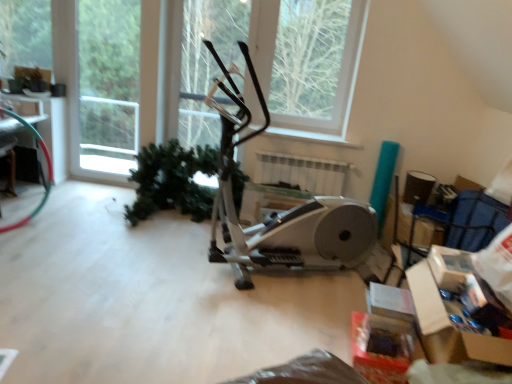
Question: Considering the relative sizes of silver metallic stationary bicycle at center and green matte tree at upper left, positioned as the second tree in right-to-left order, in the image provided, is silver metallic stationary bicycle at center thinner than green matte tree at upper left, positioned as the second tree in right-to-left order,?

Choices:
 (A) no
 (B) yes

Answer: (A)

Question: Is silver metallic stationary bicycle at center placed right next to green matte tree at upper left, positioned as the second tree in right-to-left order?

Choices:
 (A) no
 (B) yes

Answer: (A)

Question: Is silver metallic stationary bicycle at center completely or partially outside of green matte tree at upper left, positioned as the second tree in right-to-left order?

Choices:
 (A) no
 (B) yes

Answer: (B)

Question: From the image's perspective, would you say silver metallic stationary bicycle at center is shown under green matte tree at upper left, placed as the 1th tree when sorted from left to right?

Choices:
 (A) no
 (B) yes

Answer: (B)

Question: Does silver metallic stationary bicycle at center appear on the left side of green matte tree at upper left, placed as the 1th tree when sorted from left to right?

Choices:
 (A) yes
 (B) no

Answer: (B)

Question: Considering the relative positions of silver metallic stationary bicycle at center and green matte tree at upper center, which is the first tree in right-to-left order, in the image provided, is silver metallic stationary bicycle at center to the left or to the right of green matte tree at upper center, which is the first tree in right-to-left order,?

Choices:
 (A) right
 (B) left

Answer: (B)

Question: Considering the positions of point (312, 208) and point (301, 39), is point (312, 208) closer or farther from the camera than point (301, 39)?

Choices:
 (A) closer
 (B) farther

Answer: (A)

Question: Relative to green matte tree at upper center, the 2th tree when ordered from left to right, is silver metallic stationary bicycle at center in front or behind?

Choices:
 (A) behind
 (B) front

Answer: (B)

Question: Based on their sizes in the image, would you say silver metallic stationary bicycle at center is bigger or smaller than green matte tree at upper center, which is the first tree in right-to-left order?

Choices:
 (A) big
 (B) small

Answer: (A)

Question: Does point (339, 206) appear closer or farther from the camera than point (32, 13)?

Choices:
 (A) farther
 (B) closer

Answer: (B)

Question: Looking at their shapes, would you say silver metallic stationary bicycle at center is wider or thinner than green matte tree at upper left, positioned as the second tree in right-to-left order?

Choices:
 (A) thin
 (B) wide

Answer: (B)

Question: Considering the positions of silver metallic stationary bicycle at center and green matte tree at upper left, positioned as the second tree in right-to-left order, in the image, is silver metallic stationary bicycle at center bigger or smaller than green matte tree at upper left, positioned as the second tree in right-to-left order,?

Choices:
 (A) big
 (B) small

Answer: (A)

Question: Would you say silver metallic stationary bicycle at center is inside or outside green matte tree at upper left, positioned as the second tree in right-to-left order?

Choices:
 (A) outside
 (B) inside

Answer: (A)

Question: From the image's perspective, is white plastic window frame at upper left positioned above or below white plastic radiator at center?

Choices:
 (A) below
 (B) above

Answer: (B)

Question: Is white plastic window frame at upper left spatially inside white plastic radiator at center, or outside of it?

Choices:
 (A) inside
 (B) outside

Answer: (B)